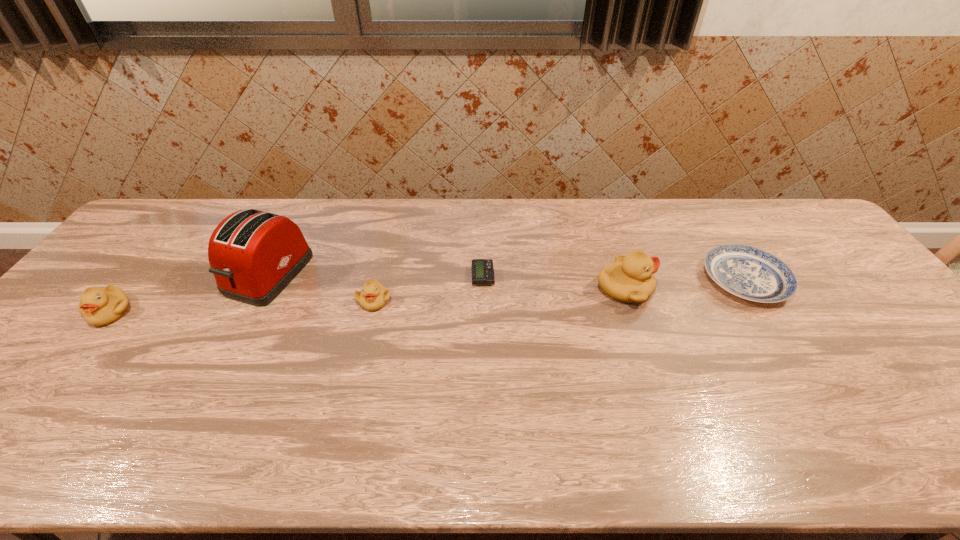
The width and height of the screenshot is (960, 540). I want to click on free space at the near edge of the desktop, so pyautogui.click(x=804, y=403).

This screenshot has width=960, height=540. What are the coordinates of `free space at the right edge of the desktop` in the screenshot? It's located at (841, 251).

The height and width of the screenshot is (540, 960). I want to click on free region at the far right corner of the desktop, so click(793, 220).

I want to click on free space between the second duckling from left to right and the plate, so click(560, 290).

Find the location of a particular element. The width and height of the screenshot is (960, 540). vacant space that is in between the shortest object and the second tallest duckling is located at coordinates (297, 294).

At what (x,y) coordinates should I click in order to perform the action: click on free space between the rightmost object and the fourth shortest object. Please return your answer as a coordinate pair (x, y). Image resolution: width=960 pixels, height=540 pixels. Looking at the image, I should click on (428, 296).

You are a GUI agent. You are given a task and a screenshot of the screen. Output one action in this format:
    pyautogui.click(x=<x>, y=<y>)
    Task: Click on the vacant area that lies between the shortest duckling and the third object from right to left
    This screenshot has width=960, height=540.
    Given the screenshot: What is the action you would take?
    pyautogui.click(x=428, y=288)

Where is `unoccupied area between the fourth object from left to right and the tallest object`? The width and height of the screenshot is (960, 540). unoccupied area between the fourth object from left to right and the tallest object is located at coordinates (375, 275).

The image size is (960, 540). Identify the location of free space between the second object from left to right and the leftmost duckling. (190, 293).

The image size is (960, 540). I want to click on free space between the shortest object and the leftmost duckling, so click(x=297, y=294).